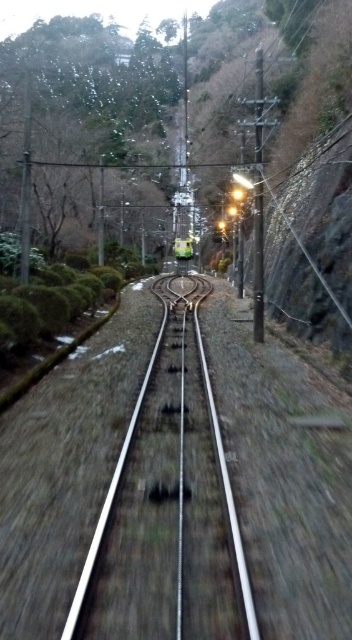
You are a photographer standing at the front of the train and want to capture both the point at coordinates (211, 429) and the point at coordinates (181, 241) in your photo. Which point will appear larger in your photo?

Point (211, 429) is closer to the camera than point (181, 241), so it will appear larger in the photo.

You are a passenger on a train traveling along the tracks. From your seat, you notice the metallic silver train track at center and the metallic green train at center. Which object is positioned lower relative to the other?

The metallic silver train track at center is located below the metallic green train at center, so it is positioned lower.